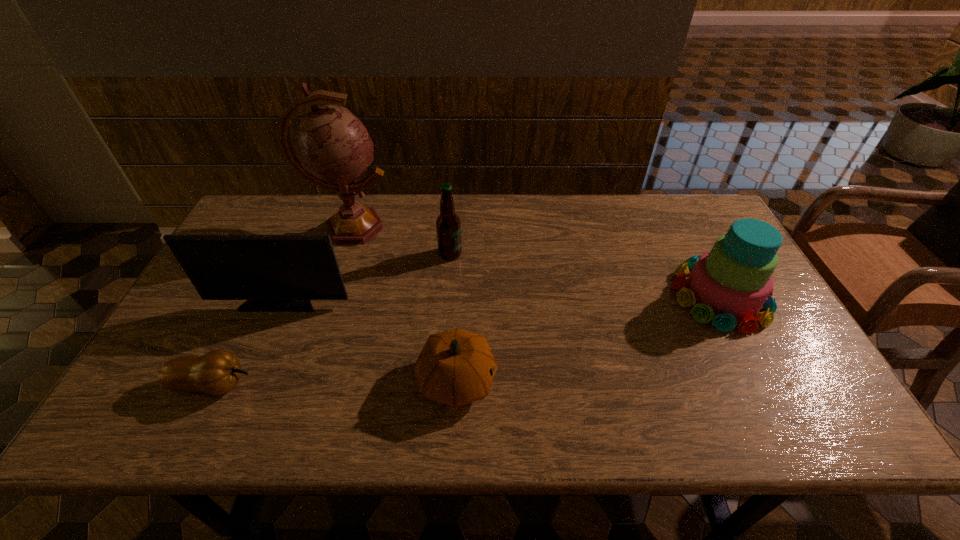
At what (x,y) coordinates should I click in order to perform the action: click on globe. Please return your answer as a coordinate pair (x, y). Image resolution: width=960 pixels, height=540 pixels. Looking at the image, I should click on (333, 149).

Where is `monitor`? This screenshot has height=540, width=960. monitor is located at coordinates (275, 273).

Find the location of a particular element. Image resolution: width=960 pixels, height=540 pixels. beer bottle is located at coordinates (448, 225).

Identify the location of the rightmost object. This screenshot has height=540, width=960. (730, 284).

You are a GUI agent. You are given a task and a screenshot of the screen. Output one action in this format:
    pyautogui.click(x=<x>, y=<y>)
    Task: Click on the taller gourd
    
    Given the screenshot: What is the action you would take?
    pyautogui.click(x=456, y=367)

Locate an element on the screen. the second shortest object is located at coordinates (456, 367).

At what (x,y) coordinates should I click in order to perform the action: click on the shortest object. Please return your answer as a coordinate pair (x, y). Image resolution: width=960 pixels, height=540 pixels. Looking at the image, I should click on (217, 372).

Where is `the shorter gourd`? This screenshot has height=540, width=960. the shorter gourd is located at coordinates (217, 372).

You are a GUI agent. You are given a task and a screenshot of the screen. Output one action in this format:
    pyautogui.click(x=<x>, y=<y>)
    Task: Click on the free region located 0.310m on the front-facing side of the tallest object
    The height and width of the screenshot is (540, 960).
    Given the screenshot: What is the action you would take?
    pyautogui.click(x=489, y=228)

You are a GUI agent. You are given a task and a screenshot of the screen. Output one action in this format:
    pyautogui.click(x=<x>, y=<y>)
    Task: Click on the vacant space located on the screen side of the monitor
    The width and height of the screenshot is (960, 540).
    Given the screenshot: What is the action you would take?
    pyautogui.click(x=259, y=352)